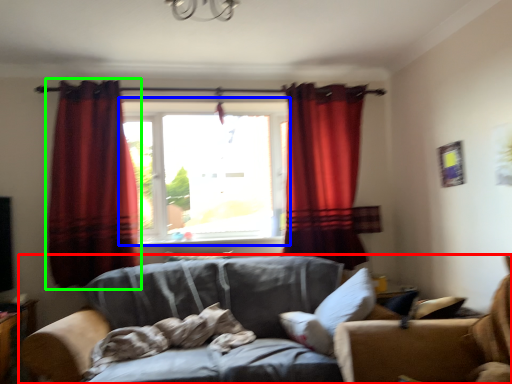
Question: Based on their relative distances, which object is farther from studio couch (highlighted by a red box)? Choose from window (highlighted by a blue box) and curtain (highlighted by a green box).

Choices:
 (A) window
 (B) curtain

Answer: (B)